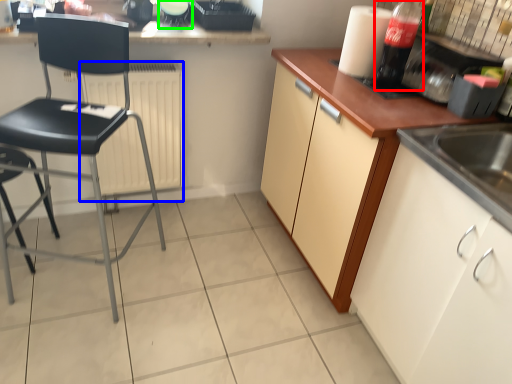
Question: Estimate the real-world distances between objects in this image. Which object is closer to bottle (highlighted by a red box), radiator (highlighted by a blue box) or appliance (highlighted by a green box)?

Choices:
 (A) radiator
 (B) appliance

Answer: (B)